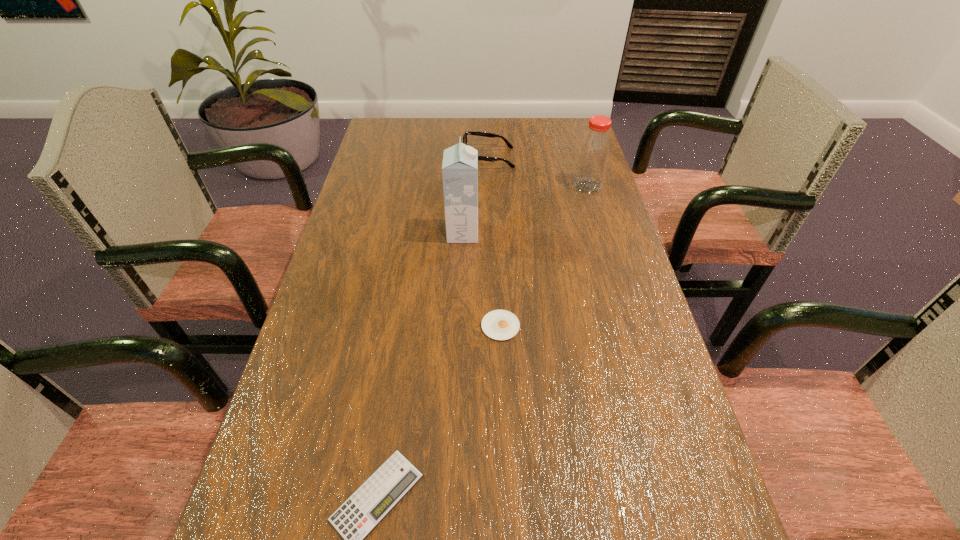
Where is `vacant point located on the lenses of the farthest object`? This screenshot has height=540, width=960. vacant point located on the lenses of the farthest object is located at coordinates (383, 158).

Find the location of a particular element. This screenshot has height=540, width=960. vacant position located on the lenses of the farthest object is located at coordinates (390, 158).

This screenshot has width=960, height=540. Find the location of `vacant space located on the lenses of the farthest object`. vacant space located on the lenses of the farthest object is located at coordinates (365, 158).

I want to click on vacant space situated on the right of the second nearest object, so click(547, 326).

At what (x,y) coordinates should I click in order to perform the action: click on object positioned at the far edge. Please return your answer as a coordinate pair (x, y). The width and height of the screenshot is (960, 540). Looking at the image, I should click on (483, 158).

Where is `object that is at the right edge`? object that is at the right edge is located at coordinates (594, 150).

Image resolution: width=960 pixels, height=540 pixels. In the image, there is a desktop. What are the coordinates of `vacant space at the far edge` in the screenshot? It's located at (438, 125).

Where is `vacant space at the left edge`? The height and width of the screenshot is (540, 960). vacant space at the left edge is located at coordinates (x=366, y=300).

Where is `vacant space at the right edge of the desktop`? This screenshot has height=540, width=960. vacant space at the right edge of the desktop is located at coordinates (630, 512).

In the image, there is a desktop. Where is `vacant area at the far left corner`? The height and width of the screenshot is (540, 960). vacant area at the far left corner is located at coordinates (378, 138).